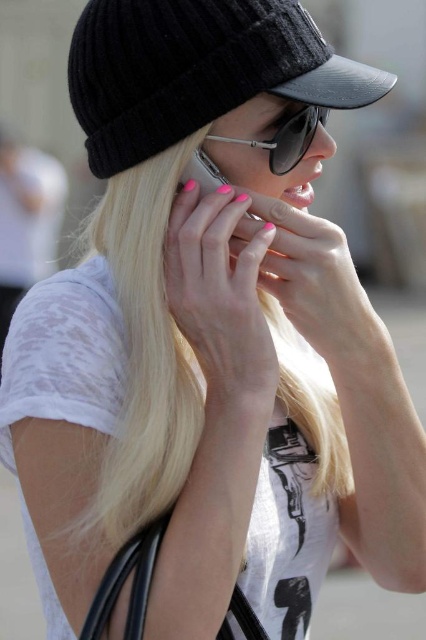
The height and width of the screenshot is (640, 426). What do you see at coordinates (196, 70) in the screenshot?
I see `black knitted baseball hat at upper left` at bounding box center [196, 70].

Between black knitted baseball hat at upper left and sunglasses at center, which one appears on the left side from the viewer's perspective?

Positioned to the left is black knitted baseball hat at upper left.

Which is behind, point (299, 83) or point (305, 106)?

The point (305, 106) is more distant.

Find the location of a particular element. This screenshot has width=426, height=640. black knitted baseball hat at upper left is located at coordinates (196, 70).